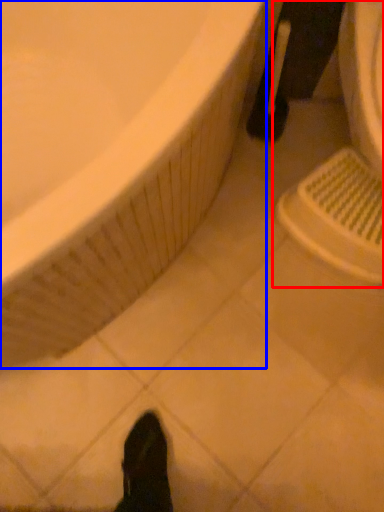
Question: Which object is further to the camera taking this photo, sink (highlighted by a red box) or bathtub (highlighted by a blue box)?

Choices:
 (A) sink
 (B) bathtub

Answer: (A)